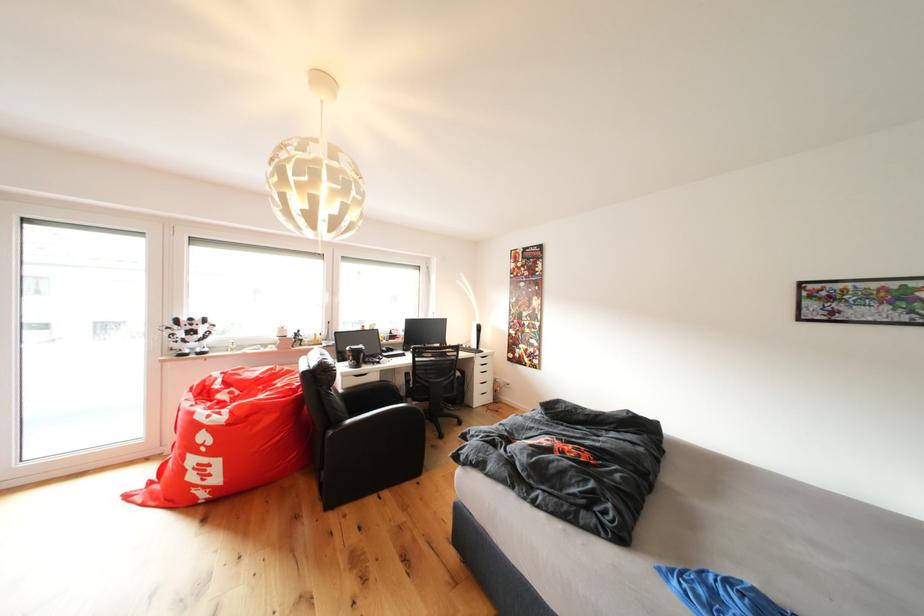
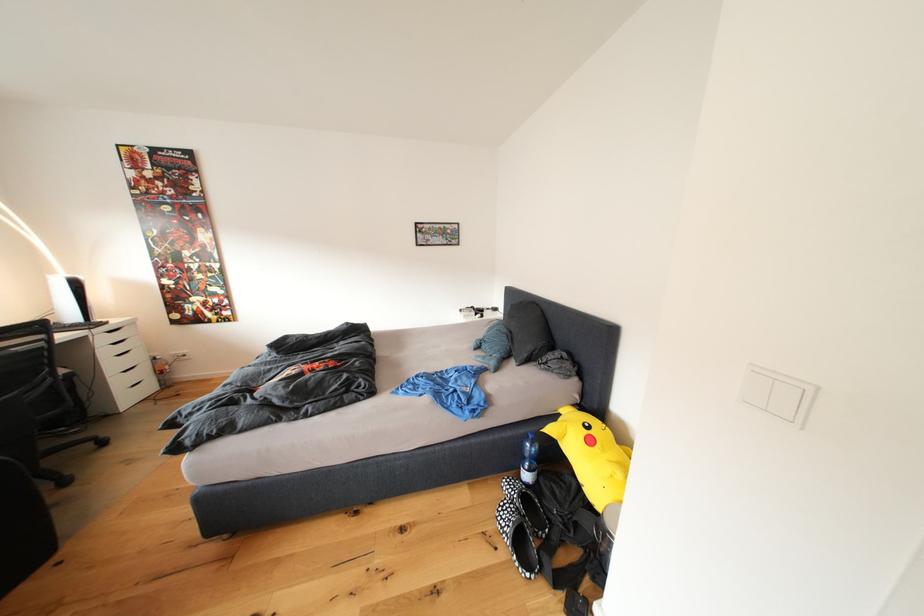
The point at (487, 382) is marked in the first image. Where is the corresponding point in the second image?

(120, 370)